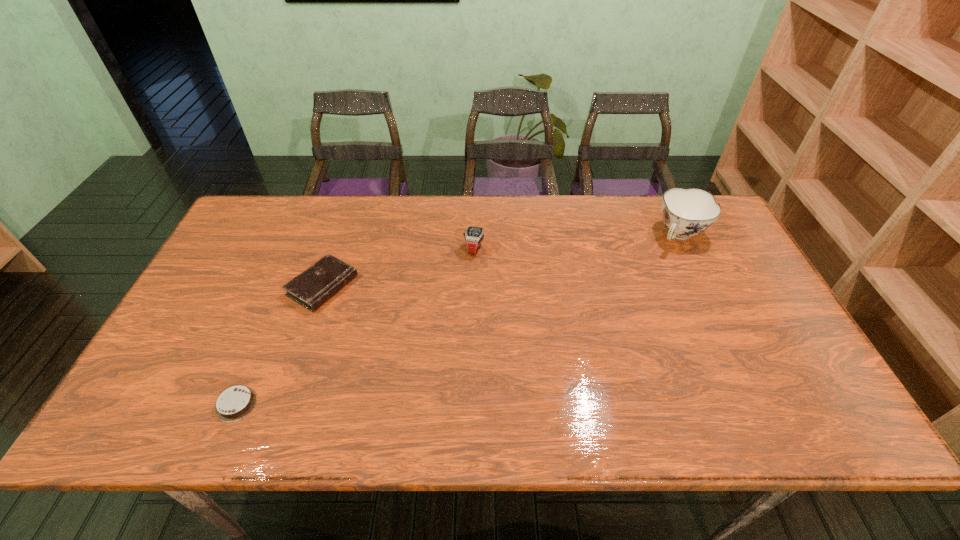
At what (x,y) coordinates should I click in order to perform the action: click on vacant space at the right edge. Please return your answer as a coordinate pair (x, y). This screenshot has width=960, height=540. Looking at the image, I should click on (745, 355).

At what (x,y) coordinates should I click in order to perform the action: click on unoccupied position between the shortest object and the second nearest object. Please return your answer as a coordinate pair (x, y). This screenshot has height=540, width=960. Looking at the image, I should click on (279, 345).

This screenshot has height=540, width=960. Find the location of `free space between the rightmost object and the diary`. free space between the rightmost object and the diary is located at coordinates (501, 260).

Find the location of a particular element. The width and height of the screenshot is (960, 540). unoccupied position between the chinaware and the second shortest object is located at coordinates (501, 260).

Locate an element on the screen. This screenshot has width=960, height=540. empty location between the chocolate cake and the third object from left to right is located at coordinates (355, 327).

Locate an element on the screen. vacant area that lies between the shortest object and the rightmost object is located at coordinates (x=458, y=320).

Where is `vacant region between the watch and the nearest object`? vacant region between the watch and the nearest object is located at coordinates (355, 327).

The width and height of the screenshot is (960, 540). Identify the location of free space between the chinaware and the second shortest object. (501, 260).

Where is `empty space that is in between the second tallest object and the chinaware`? Image resolution: width=960 pixels, height=540 pixels. empty space that is in between the second tallest object and the chinaware is located at coordinates (577, 242).

The width and height of the screenshot is (960, 540). I want to click on free space between the rightmost object and the diary, so click(x=501, y=260).